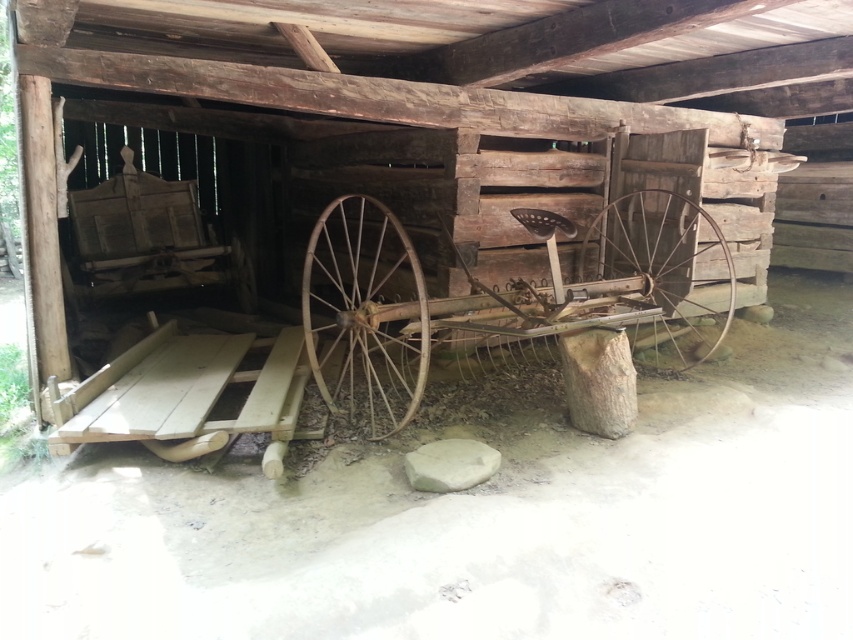
You are a farmer trying to move the rusty metal cart at center and the rusty metal wheel at center out of the barn. Which object requires more space to maneuver due to its size?

The rusty metal cart at center requires more space to maneuver because its width surpasses that of the rusty metal wheel at center.